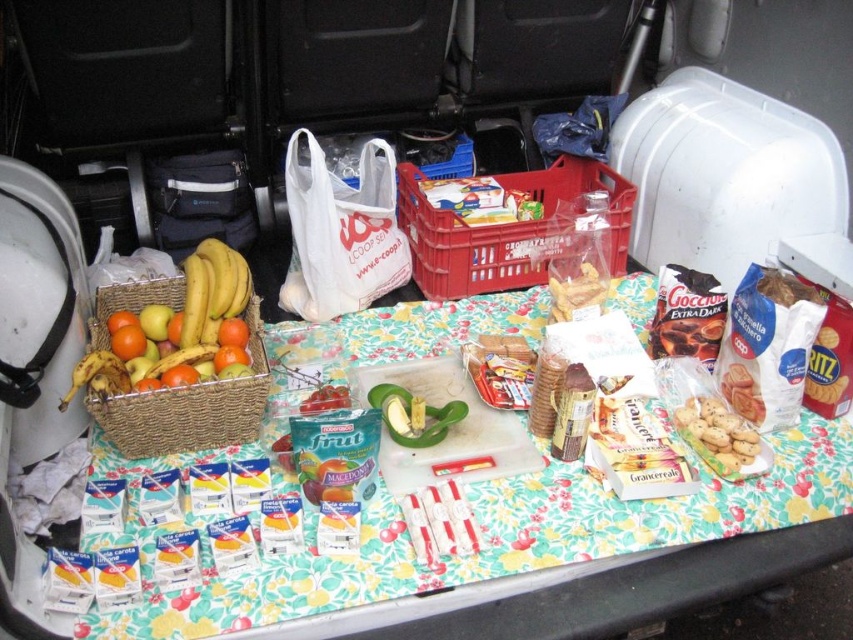
Question: Does white plastic bag at center have a smaller size compared to matte brown cookies at center?

Choices:
 (A) no
 (B) yes

Answer: (A)

Question: Based on their relative distances, which object is farther from the matte brown cookies at center?

Choices:
 (A) red plastic crate at center
 (B) white textured cookies at center-right

Answer: (B)

Question: Among these objects, which one is farthest from the camera?

Choices:
 (A) floral fabric table at center
 (B) white plastic bag at center

Answer: (B)

Question: Which is nearer to the woven brown basket at left?

Choices:
 (A) white plastic bag at center
 (B) white textured cookies at center-right
 (C) matte brown cookies at center
 (D) red plastic crate at center

Answer: (A)

Question: Is floral fabric table at center above red plastic crate at center?

Choices:
 (A) yes
 (B) no

Answer: (B)

Question: Observing the image, what is the correct spatial positioning of red plastic crate at center in reference to white textured cookies at center-right?

Choices:
 (A) left
 (B) right

Answer: (A)